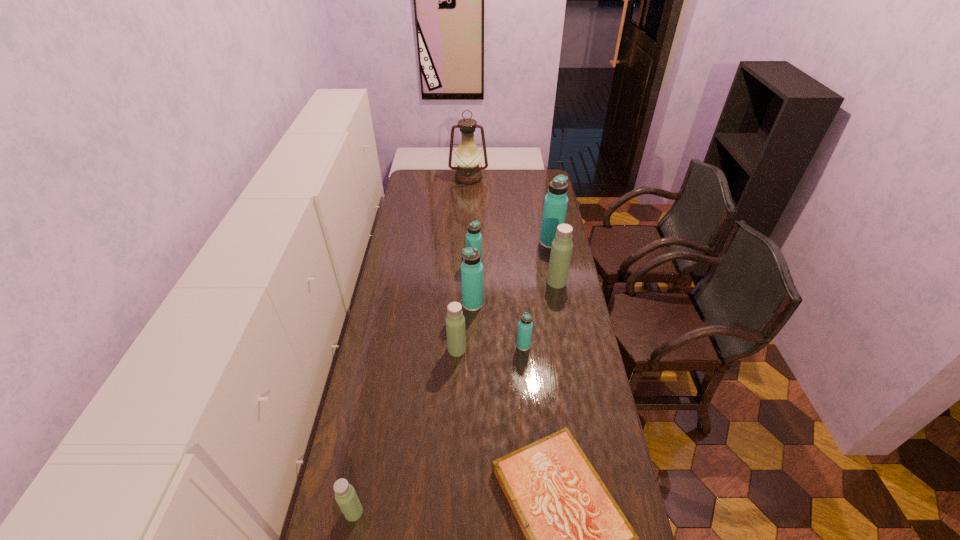
Identify the location of oil lamp. This screenshot has width=960, height=540. (467, 155).

You are a GUI agent. You are given a task and a screenshot of the screen. Output one action in this format:
    pyautogui.click(x=<x>, y=<y>)
    Task: Click on the rightmost aqua thermos bottle
    The image size is (960, 540).
    Given the screenshot: What is the action you would take?
    pyautogui.click(x=555, y=204)

You are a GUI agent. You are given a task and a screenshot of the screen. Output one action in this format:
    pyautogui.click(x=<x>, y=<y>)
    Task: Click on the farthest thermos bottle
    
    Given the screenshot: What is the action you would take?
    pyautogui.click(x=555, y=204)

The width and height of the screenshot is (960, 540). Identify the location of the second nearest aqua thermos bottle. (471, 269).

The width and height of the screenshot is (960, 540). In order to click on the second biggest aqua thermos bottle in this screenshot , I will do `click(471, 269)`.

Locate an element on the screen. The image size is (960, 540). the rightmost light thermos bottle is located at coordinates (561, 250).

The image size is (960, 540). Identify the location of the third farthest thermos bottle. (561, 250).

The height and width of the screenshot is (540, 960). Find the location of `the third farthest object`. the third farthest object is located at coordinates (473, 237).

This screenshot has height=540, width=960. What are the coordinates of `the second farthest aqua thermos bottle` in the screenshot? It's located at (473, 237).

This screenshot has height=540, width=960. In order to click on the second smallest light thermos bottle in this screenshot , I will do `click(455, 321)`.